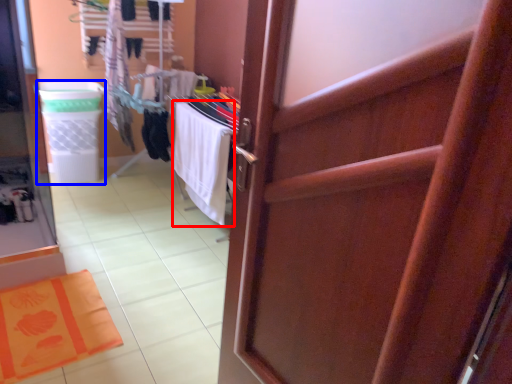
Question: Which of the following is the farthest to the observer, beach towel (highlighted by a red box) or laundry basket (highlighted by a blue box)?

Choices:
 (A) beach towel
 (B) laundry basket

Answer: (B)